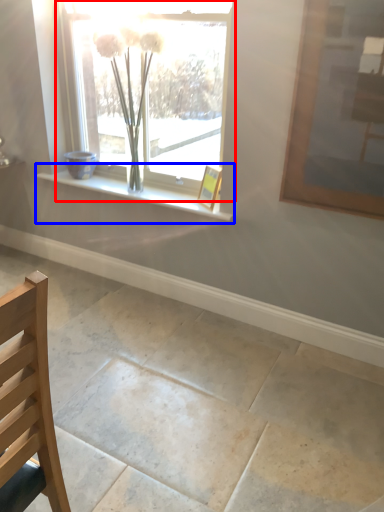
Question: Among these objects, which one is nearest to the camera, window (highlighted by a red box) or window sill (highlighted by a blue box)?

Choices:
 (A) window
 (B) window sill

Answer: (A)